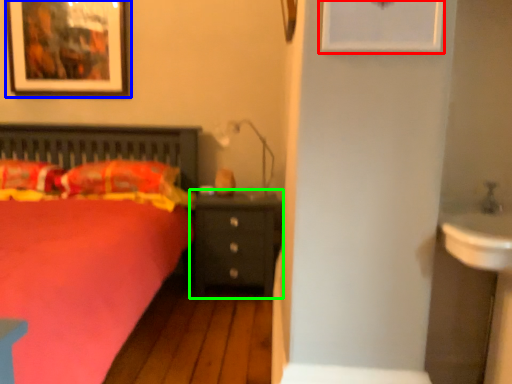
Question: Which object is the farthest from picture frame (highlighted by a red box)? Choose among these: picture frame (highlighted by a blue box) or nightstand (highlighted by a green box).

Choices:
 (A) picture frame
 (B) nightstand

Answer: (A)